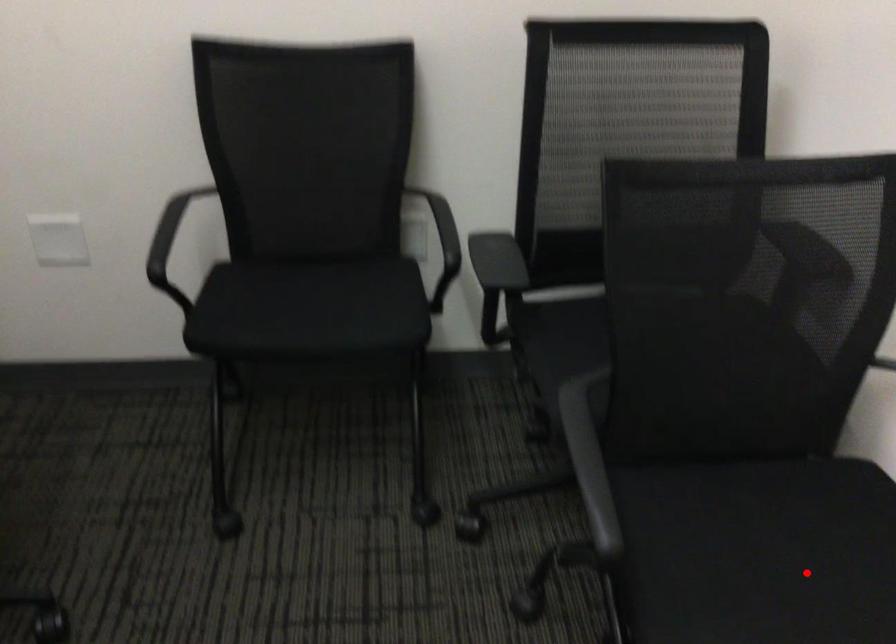
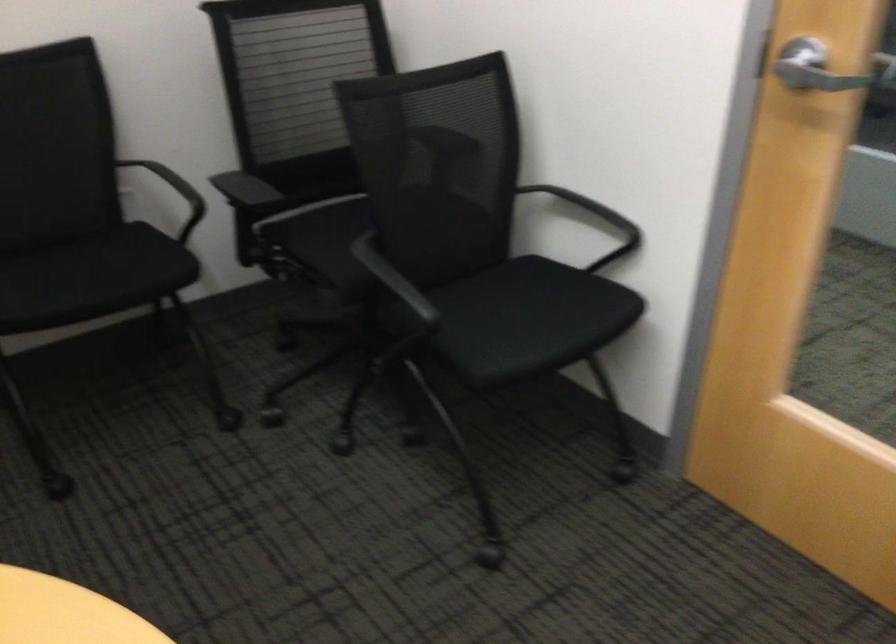
Question: I am providing you with two images of the same scene from different viewpoints. Given a red point in image1, look at the same physical point in image2. Is it:

Choices:
 (A) Closer to the viewpoint
 (B) Farther from the viewpoint

Answer: (B)